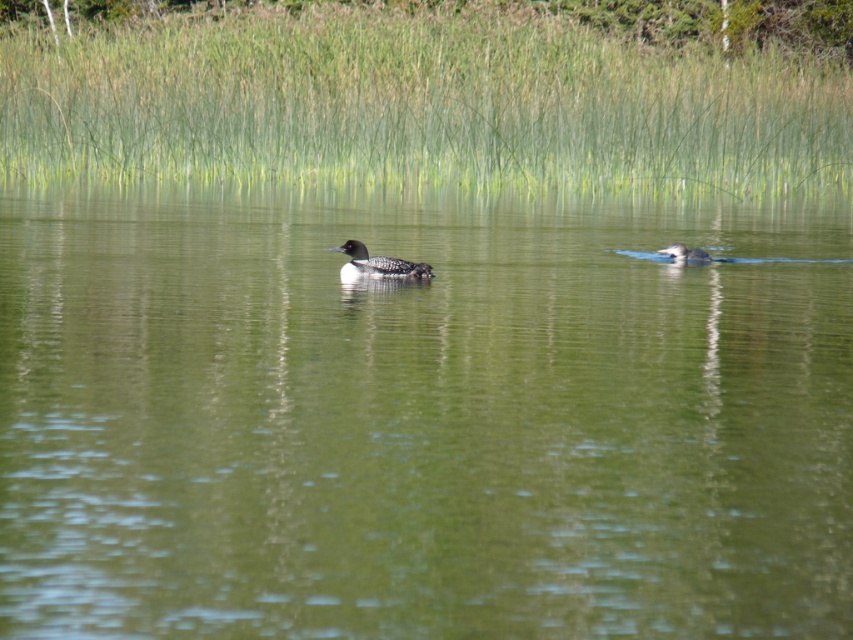
You are observing two points in the scene. The first point is at coordinates point (x=318, y=164) and the second is at point (x=685, y=244). From your perspective, which point is closer to you?

Point (x=685, y=244) is closer to you because it is in front of point (x=318, y=164) according to the spatial arrangement.

You are a photographer trying to capture the dark gray duck at center in the image. However, the green smooth water at center is blocking your view. Can you adjust your camera angle to see the duck clearly?

The green smooth water at center is positioned over the dark gray duck at center, so adjusting the camera angle downward might allow you to see the duck beneath the water surface.